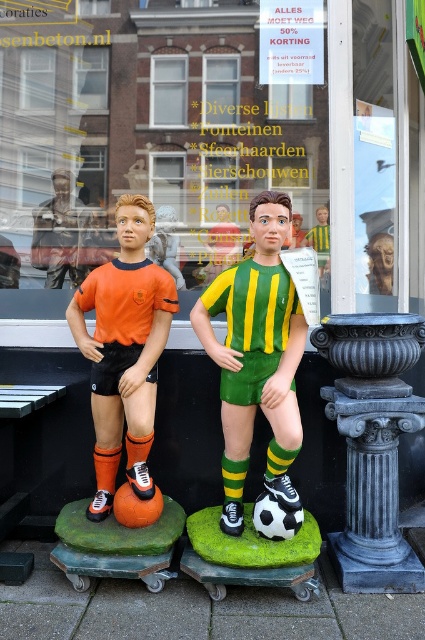
Question: In this image, where is matte plastic figurines at center located relative to orange matte soccer player at left?

Choices:
 (A) below
 (B) above

Answer: (B)

Question: Among these objects, which one is farthest from the camera?

Choices:
 (A) orange matte soccer player at left
 (B) green/yellow striped jersey at center

Answer: (A)

Question: Is green/yellow striped jersey at center wider than orange matte soccer player at left?

Choices:
 (A) no
 (B) yes

Answer: (B)

Question: Which point appears farthest from the camera in this image?

Choices:
 (A) (210, 252)
 (B) (107, 490)

Answer: (A)

Question: Which of the following is the closest to the observer?

Choices:
 (A) matte plastic figurines at center
 (B) green/yellow striped jersey at center

Answer: (B)

Question: Does matte plastic figurines at center have a greater width compared to orange matte soccer player at left?

Choices:
 (A) yes
 (B) no

Answer: (A)